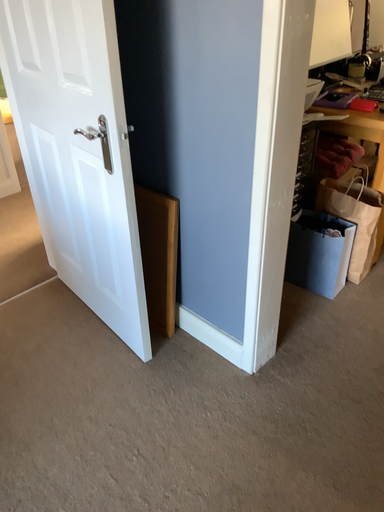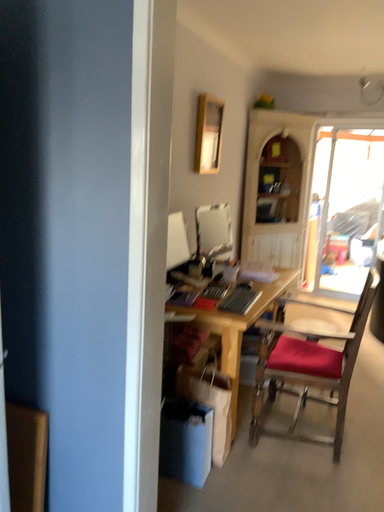
Question: Which way did the camera rotate in the video?

Choices:
 (A) rotated right
 (B) rotated left

Answer: (A)